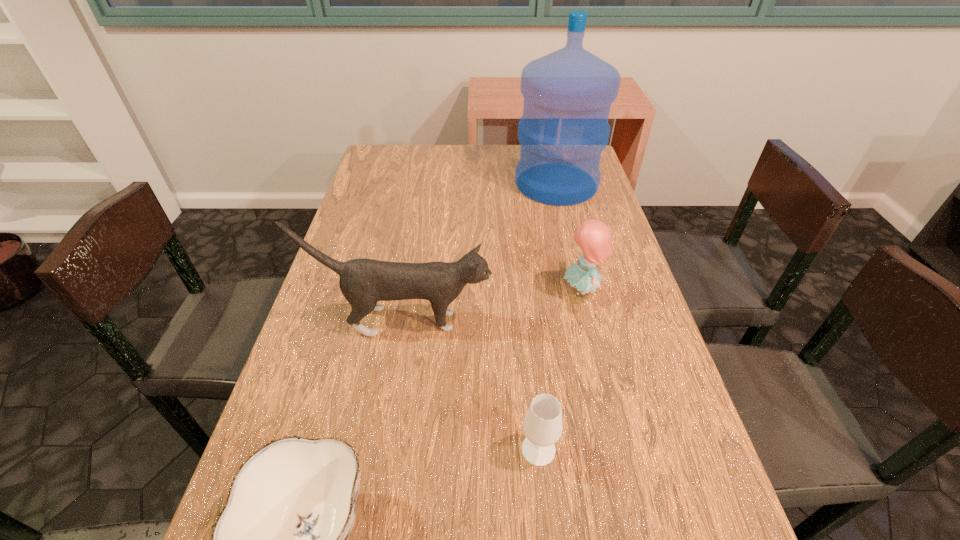
This screenshot has width=960, height=540. In order to click on vacant space located 0.320m on the back of the second nearest object in this screenshot , I will do `click(524, 305)`.

This screenshot has height=540, width=960. I want to click on object positioned at the far edge, so click(568, 93).

The height and width of the screenshot is (540, 960). I want to click on object situated at the left edge, so click(363, 282).

Find the location of a particular element. water jug located at the right edge is located at coordinates (568, 93).

At what (x,y) coordinates should I click in order to perform the action: click on doll that is at the right edge. Please return your answer as a coordinate pair (x, y). This screenshot has width=960, height=540. Looking at the image, I should click on (593, 237).

Where is `object at the far right corner`? This screenshot has width=960, height=540. object at the far right corner is located at coordinates (568, 93).

Find the location of `free space at the far edge`. free space at the far edge is located at coordinates (448, 156).

Locate an element on the screen. This screenshot has width=960, height=540. free region at the left edge is located at coordinates (377, 193).

The image size is (960, 540). Identify the location of vacant space at the right edge of the desktop. (597, 193).

Identify the location of vacant space that is in between the water jug and the cat. click(479, 253).